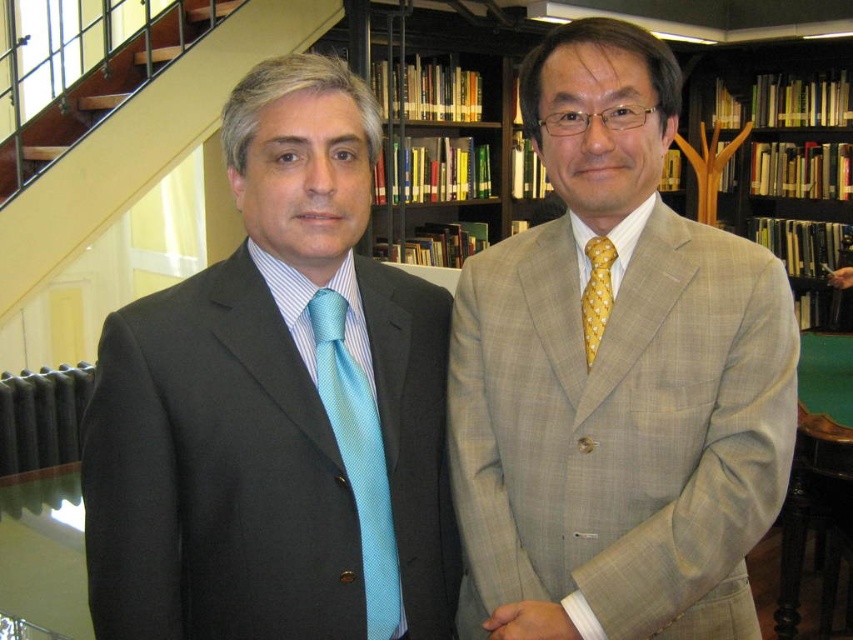
You are organizing a formal event and need to ensure proper seating arrangements. You have two guests dressed in the matte black suit at left and the yellow dotted tie at right. Based on their positions in the image, which guest should be seated to the left of the other during the event?

The matte black suit at left should be seated to the left of the yellow dotted tie at right because in the image, the matte black suit at left is positioned on the left side of yellow dotted tie at right.

You are an interior designer assessing the layout of a library. You notice the matte black suit at left and the yellow dotted tie at right. Which object is positioned lower in the image?

The matte black suit at left is positioned below the yellow dotted tie at right, so the matte black suit at left is lower in the image.

You are standing in the library and see the two individuals described. There is a specific point marked at coordinates (277, 406). Which person is this point located on?

The point at coordinates (277, 406) is on the matte black suit at left.